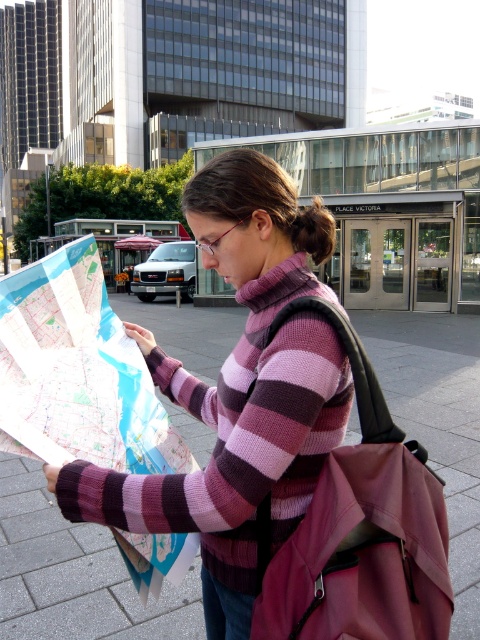
Question: Does paper map at center have a lesser width compared to brown hair at center?

Choices:
 (A) no
 (B) yes

Answer: (A)

Question: Which of the following is the closest to the observer?

Choices:
 (A) (151, 435)
 (B) (320, 259)

Answer: (B)

Question: Which point is farther from the camera taking this photo?

Choices:
 (A) (107, 339)
 (B) (175, 372)

Answer: (B)

Question: Which object is farther from the camera taking this photo?

Choices:
 (A) brown hair at center
 (B) paper map at center

Answer: (A)

Question: Is striped sweater at center further to the viewer compared to paper map at center?

Choices:
 (A) yes
 (B) no

Answer: (B)

Question: Is striped sweater at center further to the viewer compared to paper map at center?

Choices:
 (A) yes
 (B) no

Answer: (B)